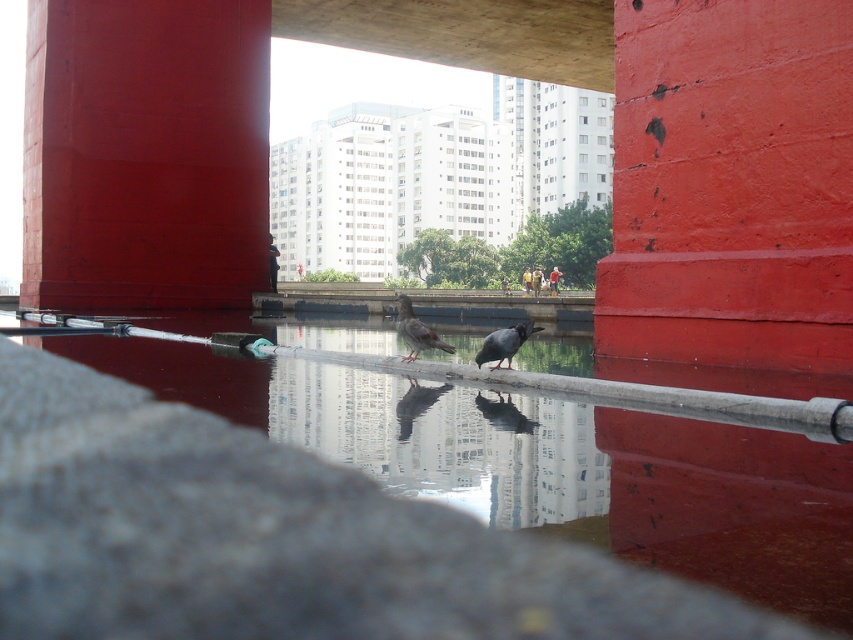
Question: Is gray matte bird at center to the right of matte gray bird at center from the viewer's perspective?

Choices:
 (A) yes
 (B) no

Answer: (B)

Question: Is the position of smooth red pillar at upper left more distant than that of matte gray bird at center?

Choices:
 (A) yes
 (B) no

Answer: (A)

Question: Among these points, which one is farthest from the camera?

Choices:
 (A) 409,326
 (B) 267,72

Answer: (B)

Question: Which object is positioned farthest from the smooth concrete rail at center?

Choices:
 (A) gray matte bird at center
 (B) smooth red pillar at upper left

Answer: (B)

Question: Does gray matte bird at center have a lesser width compared to matte gray bird at center?

Choices:
 (A) yes
 (B) no

Answer: (A)

Question: Which point is closer to the camera?

Choices:
 (A) gray matte bird at center
 (B) smooth red paint at center
 (C) matte gray bird at center

Answer: (B)